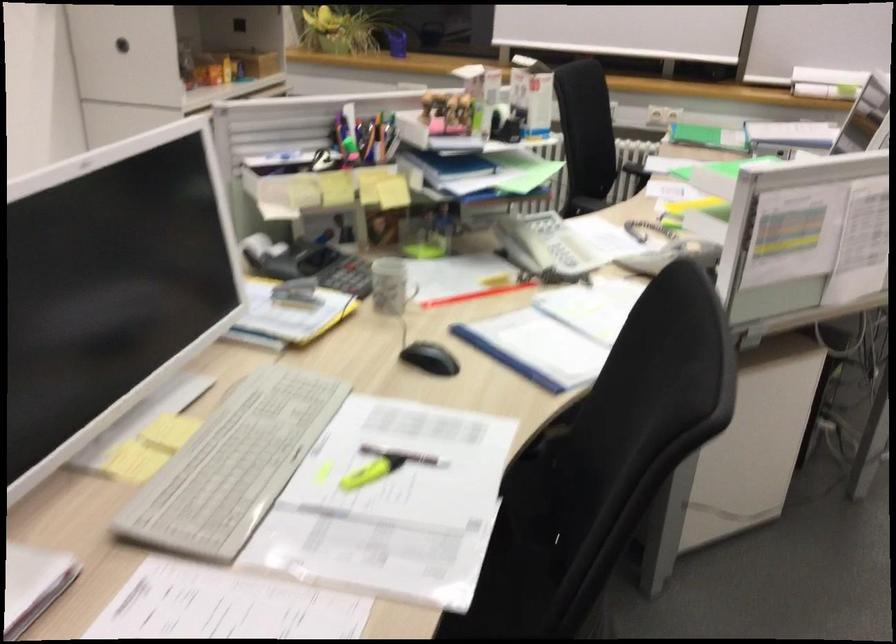
Image resolution: width=896 pixels, height=644 pixels. I want to click on black chair armrest, so click(x=588, y=204).